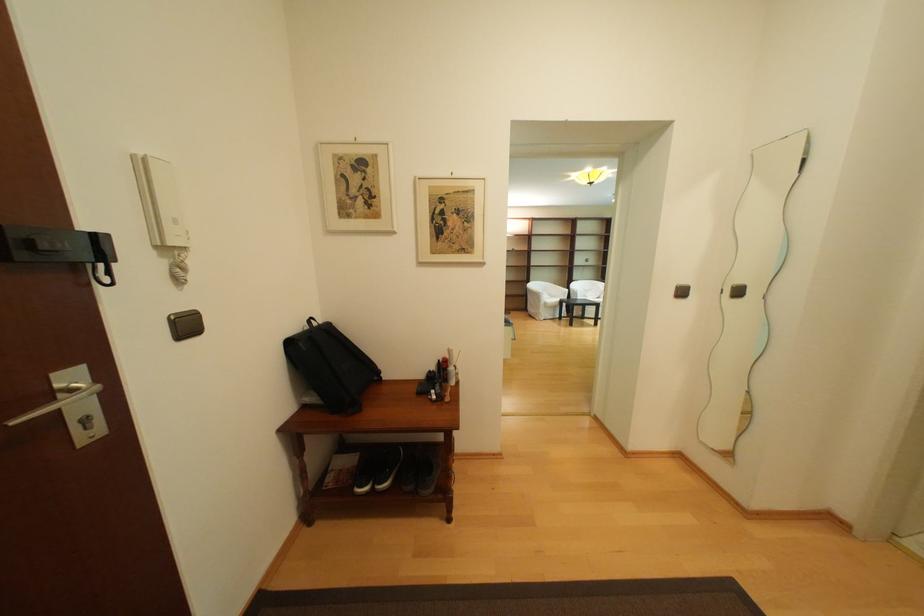
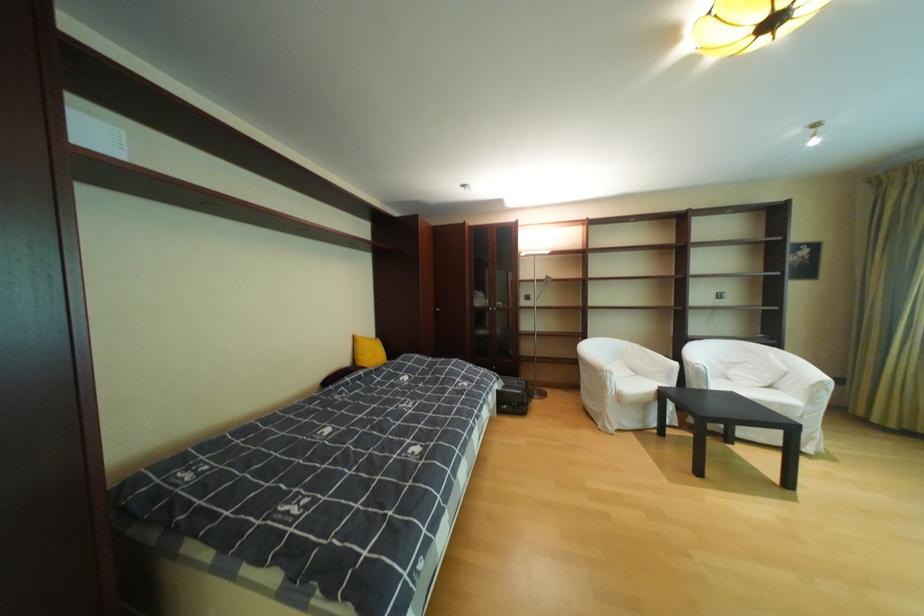
Find the pixel in the second image that matches the point at 553,296 in the first image.

(621, 377)